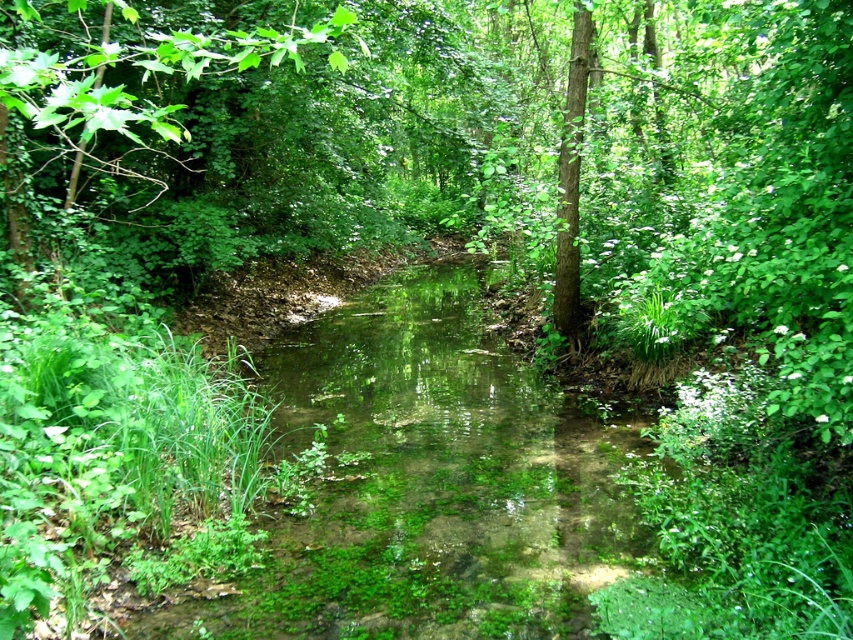
Question: Can you confirm if green mossy stream at center is wider than green rough bark tree at center?

Choices:
 (A) yes
 (B) no

Answer: (A)

Question: Which of these objects is positioned closest to the green rough bark tree at center?

Choices:
 (A) green leafy tree at upper left
 (B) green mossy stream at center

Answer: (B)

Question: Is green mossy stream at center positioned in front of green rough bark tree at center?

Choices:
 (A) yes
 (B) no

Answer: (A)

Question: Which object is closer to the camera taking this photo?

Choices:
 (A) green rough bark tree at center
 (B) green leafy tree at upper left
 (C) green mossy stream at center

Answer: (B)

Question: Can you confirm if green mossy stream at center is thinner than green leafy tree at upper left?

Choices:
 (A) no
 (B) yes

Answer: (B)

Question: Which object is farther from the camera taking this photo?

Choices:
 (A) green rough bark tree at center
 (B) green leafy tree at upper left

Answer: (A)